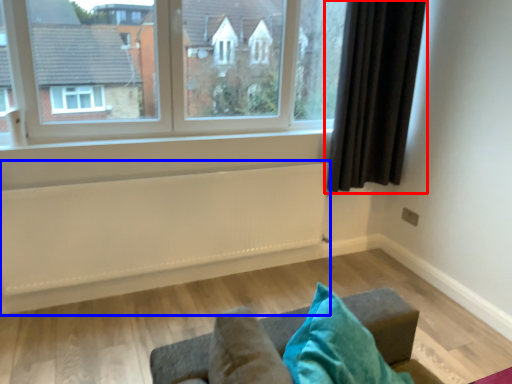
Question: Among these objects, which one is farthest to the camera, curtain (highlighted by a red box) or radiator (highlighted by a blue box)?

Choices:
 (A) curtain
 (B) radiator

Answer: (A)